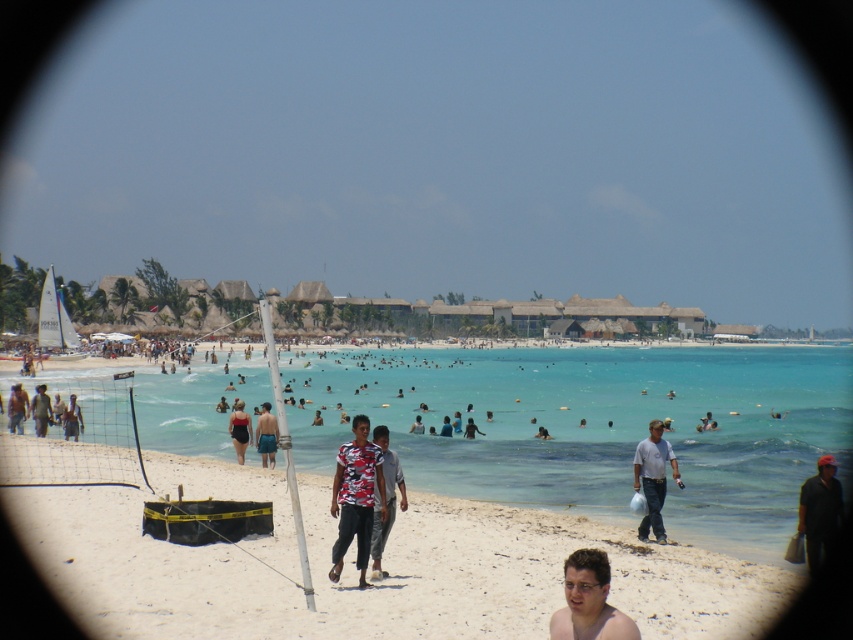
Based on the photo, can you confirm if clear blue water at center is taller than shiny tan skin at lower center?

Yes.

Is clear blue water at center positioned at the back of shiny tan skin at lower center?

Yes, clear blue water at center is behind shiny tan skin at lower center.

Locate an element on the screen. This screenshot has height=640, width=853. clear blue water at center is located at coordinates (596, 426).

Measure the distance between point (654, 474) and camera.

A distance of 65.88 feet exists between point (654, 474) and camera.

Where is `gray cotton shirt at lower right`? gray cotton shirt at lower right is located at coordinates (653, 477).

Which is in front, point (677, 477) or point (467, 426)?

Point (677, 477)

I want to click on gray cotton shirt at lower right, so pos(653,477).

This screenshot has width=853, height=640. What do you see at coordinates (239, 429) in the screenshot?
I see `black swimsuit at center` at bounding box center [239, 429].

Can you confirm if black swimsuit at center is taller than dark blue shirt at center?

Yes.

Which is in front, point (242, 456) or point (76, 406)?

Point (242, 456)

Locate an element on the screen. The height and width of the screenshot is (640, 853). black swimsuit at center is located at coordinates (239, 429).